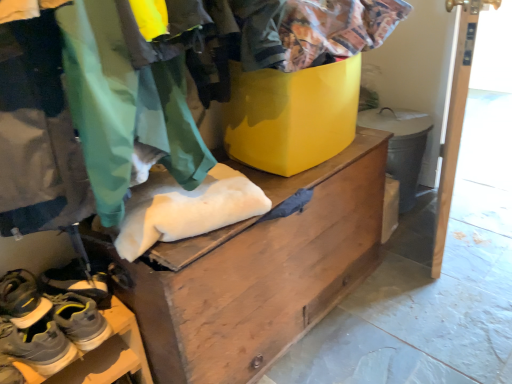
Question: Does gray suede sneakers at lower left, the 1th footwear viewed from the top, touch white wood door at right?

Choices:
 (A) yes
 (B) no

Answer: (B)

Question: Does gray suede sneakers at lower left, the 1th footwear viewed from the top, have a larger size compared to white wood door at right?

Choices:
 (A) no
 (B) yes

Answer: (A)

Question: Does gray suede sneakers at lower left, the 3th footwear positioned from the bottom, have a lesser width compared to white wood door at right?

Choices:
 (A) yes
 (B) no

Answer: (B)

Question: Is gray suede sneakers at lower left, the 1th footwear viewed from the top, shorter than white wood door at right?

Choices:
 (A) no
 (B) yes

Answer: (B)

Question: From a real-world perspective, is gray suede sneakers at lower left, the 3th footwear positioned from the bottom, over white wood door at right?

Choices:
 (A) yes
 (B) no

Answer: (B)

Question: Is gray suede sneakers at lower left, which is counted as the 3th footwear, starting from the top, wider or thinner than camouflage fabric pants at lower left?

Choices:
 (A) thin
 (B) wide

Answer: (A)

Question: Based on their positions, is gray suede sneakers at lower left, which is counted as the 3th footwear, starting from the top, located to the left or right of camouflage fabric pants at lower left?

Choices:
 (A) left
 (B) right

Answer: (A)

Question: Is point (44, 324) closer or farther from the camera than point (140, 86)?

Choices:
 (A) closer
 (B) farther

Answer: (B)

Question: Considering the positions of gray suede sneakers at lower left, which is counted as the 3th footwear, starting from the top, and camouflage fabric pants at lower left in the image, is gray suede sneakers at lower left, which is counted as the 3th footwear, starting from the top, bigger or smaller than camouflage fabric pants at lower left?

Choices:
 (A) small
 (B) big

Answer: (A)

Question: From the image's perspective, is gray suede sneakers at lower left, the 3th footwear positioned from the bottom, positioned above or below gray suede sneakers at lower left, the 2th footwear when ordered from top to bottom?

Choices:
 (A) below
 (B) above

Answer: (B)

Question: Is gray suede sneakers at lower left, the 1th footwear viewed from the top, in front of or behind gray suede sneakers at lower left, positioned as the second footwear in bottom-to-top order, in the image?

Choices:
 (A) front
 (B) behind

Answer: (B)

Question: From a real-world perspective, is gray suede sneakers at lower left, the 3th footwear positioned from the bottom, above or below gray suede sneakers at lower left, the 2th footwear when ordered from top to bottom?

Choices:
 (A) below
 (B) above

Answer: (A)

Question: In terms of width, does gray suede sneakers at lower left, the 1th footwear viewed from the top, look wider or thinner when compared to gray suede sneakers at lower left, positioned as the second footwear in bottom-to-top order?

Choices:
 (A) thin
 (B) wide

Answer: (A)

Question: Considering the positions of white wood door at right and gray suede sneakers at lower left, the 1th footwear viewed from the top, in the image, is white wood door at right wider or thinner than gray suede sneakers at lower left, the 1th footwear viewed from the top,?

Choices:
 (A) wide
 (B) thin

Answer: (B)

Question: Choose the correct answer: Is white wood door at right inside gray suede sneakers at lower left, the 1th footwear viewed from the top, or outside it?

Choices:
 (A) outside
 (B) inside

Answer: (A)